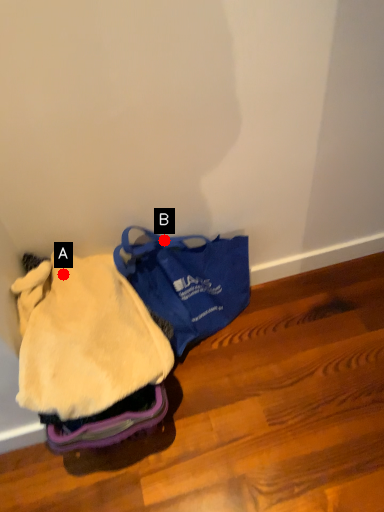
Question: Two points are circled on the image, labeled by A and B beside each circle. Which point is farther from the camera taking this photo?

Choices:
 (A) A is further
 (B) B is further

Answer: (B)